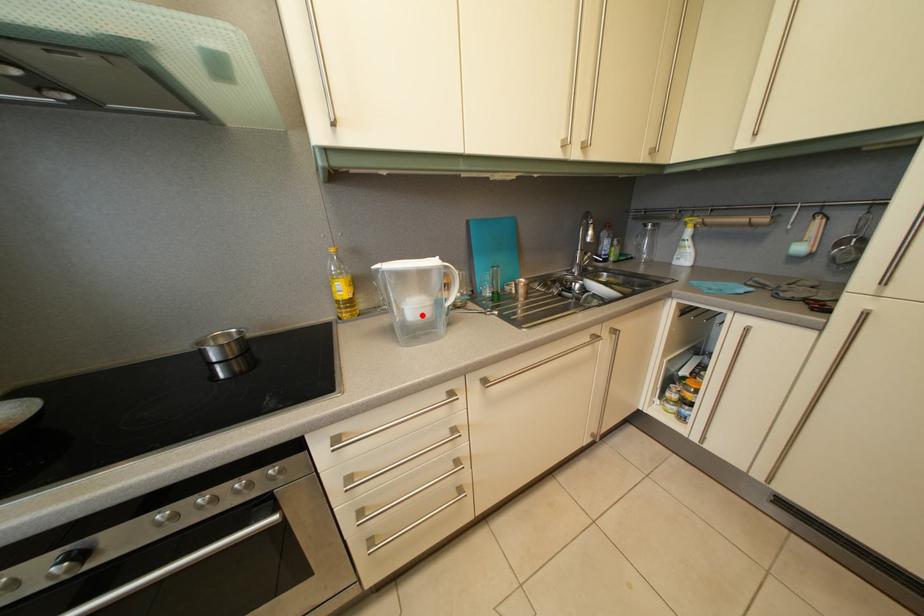
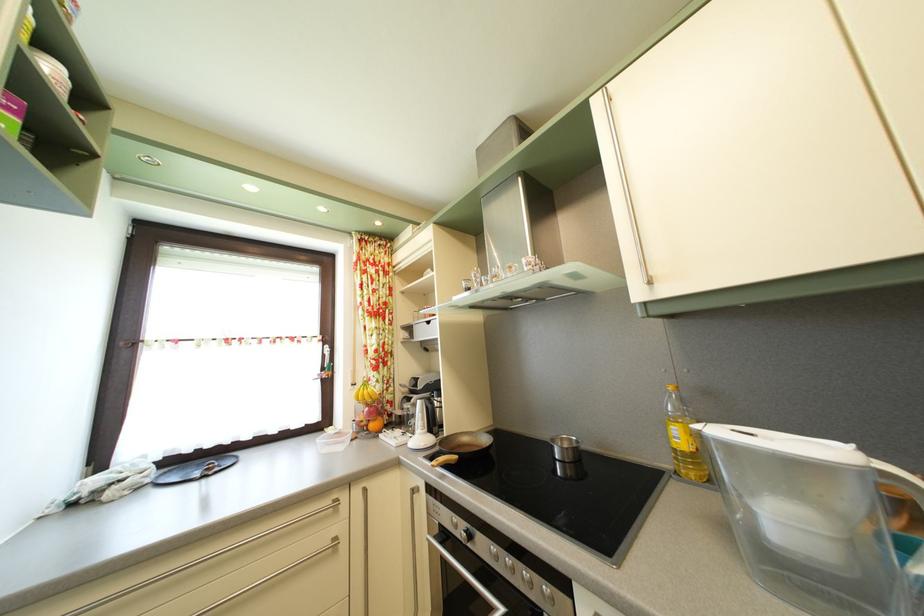
Locate, in the second image, the point that corresponds to the highlighted location in the first image.

(793, 528)